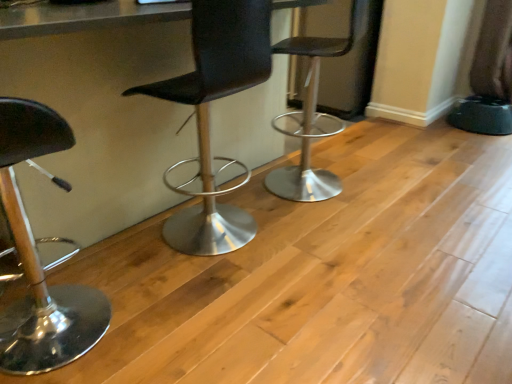
Question: From a real-world perspective, is black leather stool at center, which is counted as the 1th chair, starting from the right, under black leather chair at center, positioned as the second chair in right-to-left order?

Choices:
 (A) yes
 (B) no

Answer: (A)

Question: Is black leather stool at center, the third chair viewed from the left, at the right side of black leather chair at center, positioned as the second chair in right-to-left order?

Choices:
 (A) yes
 (B) no

Answer: (A)

Question: Is black leather stool at center, which is counted as the 1th chair, starting from the right, oriented away from black leather chair at center, which is the 2th chair in left-to-right order?

Choices:
 (A) no
 (B) yes

Answer: (A)

Question: Does black leather stool at center, the third chair viewed from the left, have a smaller size compared to black leather chair at center, positioned as the second chair in right-to-left order?

Choices:
 (A) no
 (B) yes

Answer: (A)

Question: From a real-world perspective, is black leather stool at center, the third chair viewed from the left, positioned over black leather chair at center, which is the 2th chair in left-to-right order, based on gravity?

Choices:
 (A) no
 (B) yes

Answer: (A)

Question: From a real-world perspective, is shiny black stool at left, the 1th chair positioned from the left, positioned above or below black leather chair at center, positioned as the second chair in right-to-left order?

Choices:
 (A) below
 (B) above

Answer: (A)

Question: In the image, is shiny black stool at left, the third chair positioned from the right, positioned in front of or behind black leather chair at center, which is the 2th chair in left-to-right order?

Choices:
 (A) behind
 (B) front

Answer: (B)

Question: Considering the positions of shiny black stool at left, the 1th chair positioned from the left, and black leather chair at center, which is the 2th chair in left-to-right order, in the image, is shiny black stool at left, the 1th chair positioned from the left, taller or shorter than black leather chair at center, which is the 2th chair in left-to-right order,?

Choices:
 (A) short
 (B) tall

Answer: (A)

Question: Is shiny black stool at left, the 1th chair positioned from the left, bigger or smaller than black leather chair at center, which is the 2th chair in left-to-right order?

Choices:
 (A) small
 (B) big

Answer: (A)

Question: Does point (177, 115) appear closer or farther from the camera than point (316, 67)?

Choices:
 (A) closer
 (B) farther

Answer: (A)

Question: From a real-world perspective, is metallic gray table at center physically located above or below black leather stool at center, the third chair viewed from the left?

Choices:
 (A) above
 (B) below

Answer: (B)

Question: Is metallic gray table at center inside or outside of black leather stool at center, the third chair viewed from the left?

Choices:
 (A) outside
 (B) inside

Answer: (A)

Question: Considering the relative positions of metallic gray table at center and black leather stool at center, which is counted as the 1th chair, starting from the right, in the image provided, is metallic gray table at center to the left or to the right of black leather stool at center, which is counted as the 1th chair, starting from the right,?

Choices:
 (A) right
 (B) left

Answer: (B)

Question: Would you say shiny black stool at left, the 1th chair positioned from the left, is to the left or to the right of black leather stool at center, the third chair viewed from the left, in the picture?

Choices:
 (A) right
 (B) left

Answer: (B)

Question: From their relative heights in the image, would you say shiny black stool at left, the third chair positioned from the right, is taller or shorter than black leather stool at center, which is counted as the 1th chair, starting from the right?

Choices:
 (A) tall
 (B) short

Answer: (B)